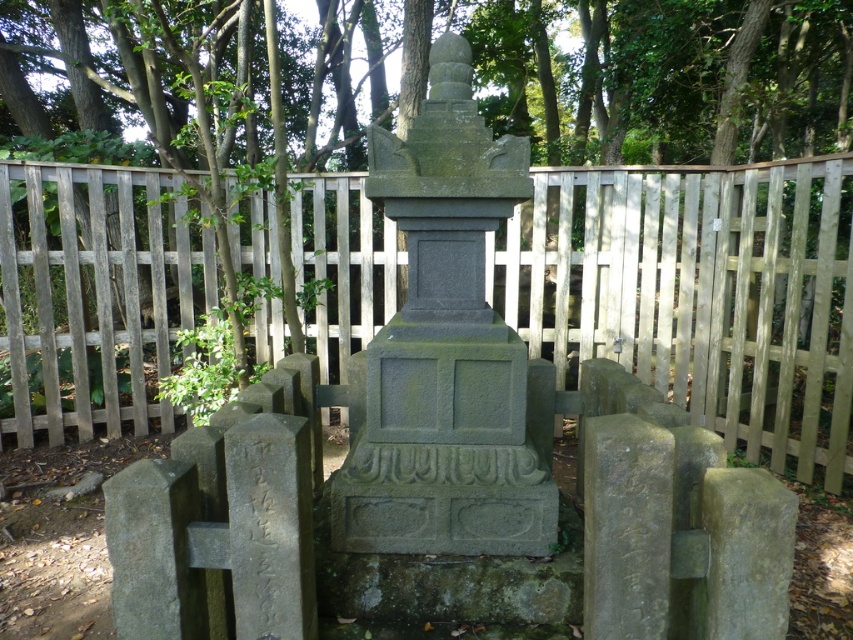
Based on the photo, between wooden fence at center and gray stone monument at center, which one has less height?

wooden fence at center is shorter.

Does wooden fence at center appear under gray stone monument at center?

Incorrect, wooden fence at center is not positioned below gray stone monument at center.

Which is behind, point (732, 392) or point (532, 538)?

Positioned behind is point (732, 392).

Where is `wooden fence at center`? The image size is (853, 640). wooden fence at center is located at coordinates (698, 292).